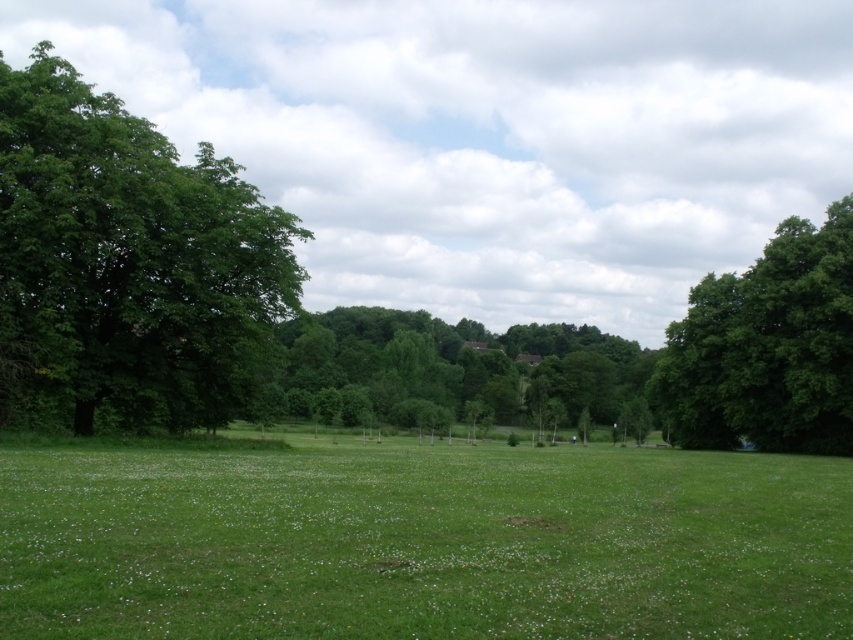
Which is in front, point (817, 404) or point (532, 353)?

Point (817, 404) is more forward.

Does green leafy tree at right appear on the left side of green leafy tree at center?

In fact, green leafy tree at right is to the right of green leafy tree at center.

Which is in front, point (656, 369) or point (614, 358)?

Positioned in front is point (656, 369).

You are a GUI agent. You are given a task and a screenshot of the screen. Output one action in this format:
    pyautogui.click(x=<x>, y=<y>)
    Task: Click on the green leafy tree at right
    The image size is (853, 640).
    Given the screenshot: What is the action you would take?
    pyautogui.click(x=767, y=348)

Does green grassy field at center appear on the right side of green leafy tree at center?

Incorrect, green grassy field at center is not on the right side of green leafy tree at center.

Who is taller, green grassy field at center or green leafy tree at center?

Standing taller between the two is green leafy tree at center.

This screenshot has height=640, width=853. I want to click on green grassy field at center, so click(x=422, y=541).

Which is above, green grassy field at center or green leafy tree at left?

Positioned higher is green leafy tree at left.

Consider the image. Is the position of green grassy field at center less distant than that of green leafy tree at left?

Yes, it is.

The width and height of the screenshot is (853, 640). In order to click on green grassy field at center in this screenshot , I will do coord(422,541).

The height and width of the screenshot is (640, 853). What are the coordinates of `green grassy field at center` in the screenshot? It's located at (422, 541).